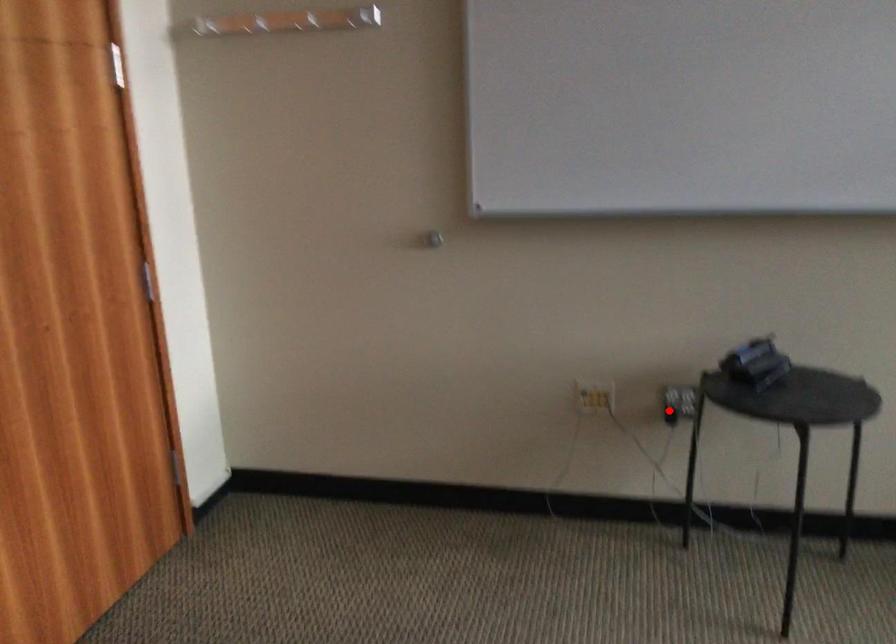
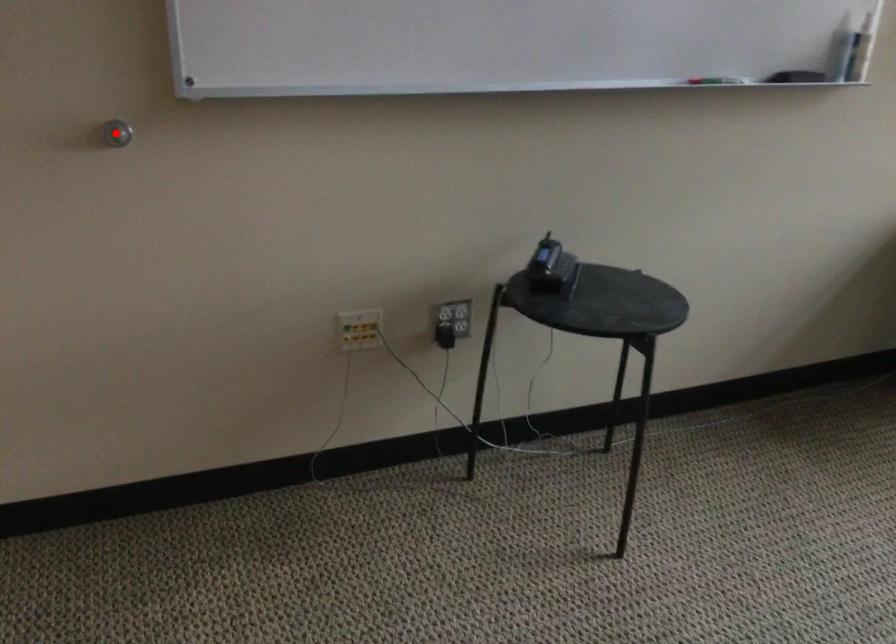
I am providing you with two images of the same scene from different viewpoints. A red point is marked on the first image and another point is marked on the second image. Do the highlighted points in image1 and image2 indicate the same real-world spot?

No